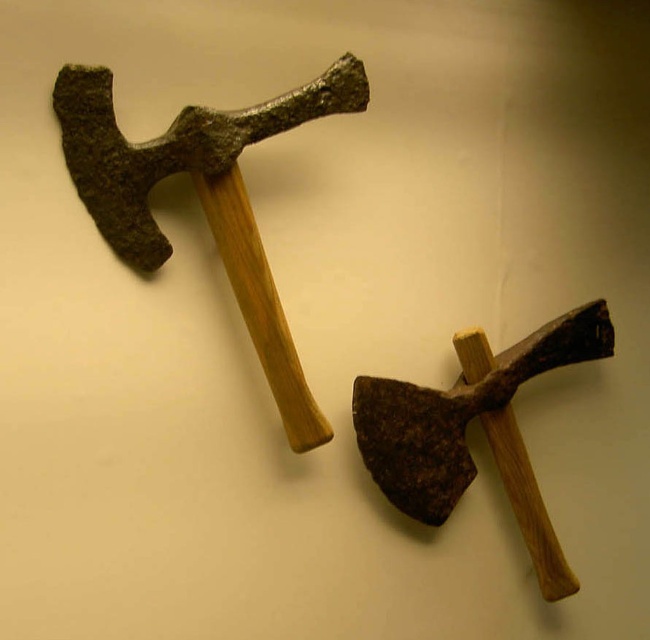
Question: Which object appears farthest from the camera in this image?

Choices:
 (A) rusty metal hammer at upper left
 (B) rusty metal hammer at center

Answer: (B)

Question: Does rusty metal hammer at upper left have a lesser width compared to rusty metal hammer at center?

Choices:
 (A) yes
 (B) no

Answer: (B)

Question: Which point is closer to the camera taking this photo?

Choices:
 (A) (213, 202)
 (B) (404, 381)

Answer: (A)

Question: From the image, what is the correct spatial relationship of rusty metal hammer at upper left in relation to rusty metal hammer at center?

Choices:
 (A) right
 (B) left

Answer: (B)

Question: Is rusty metal hammer at upper left further to the viewer compared to rusty metal hammer at center?

Choices:
 (A) no
 (B) yes

Answer: (A)